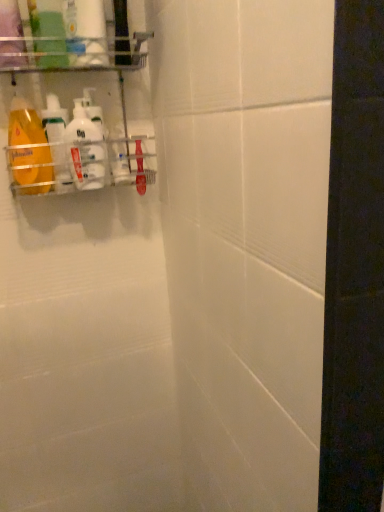
Question: Based on their positions, is white glossy bottle at left, which is the 3th cleaning product in left-to-right order, located to the left or right of white glossy bottle at upper left, the fourth cleaning product when ordered from left to right?

Choices:
 (A) left
 (B) right

Answer: (A)

Question: Looking at their shapes, would you say white glossy bottle at left, which is the 3th cleaning product in left-to-right order, is wider or thinner than white glossy bottle at upper left, the fourth cleaning product when ordered from left to right?

Choices:
 (A) thin
 (B) wide

Answer: (A)

Question: Estimate the real-world distances between objects in this image. Which object is farther from the translucent plastic bottle at left, the 2th cleaning product from the left?

Choices:
 (A) white glossy bottle at upper left, the fifth cleaning product in the left-to-right sequence
 (B) white glossy bottle at upper left, the fourth cleaning product when ordered from left to right
 (C) white glossy bottle at left, the 3th cleaning product positioned from the right
 (D) metallic silver rack at upper left
 (E) matte orange bottle at left, which is the fifth cleaning product in right-to-left order

Answer: (B)

Question: Which object is positioned farthest from the translucent plastic bottle at left, the 2th cleaning product from the left?

Choices:
 (A) metallic silver rack at upper left
 (B) white glossy bottle at left, the 3th cleaning product positioned from the right
 (C) matte orange bottle at left, which is the fifth cleaning product in right-to-left order
 (D) white glossy bottle at upper left, the first cleaning product from the right
 (E) white glossy bottle at upper left, the fourth cleaning product when ordered from left to right

Answer: (E)